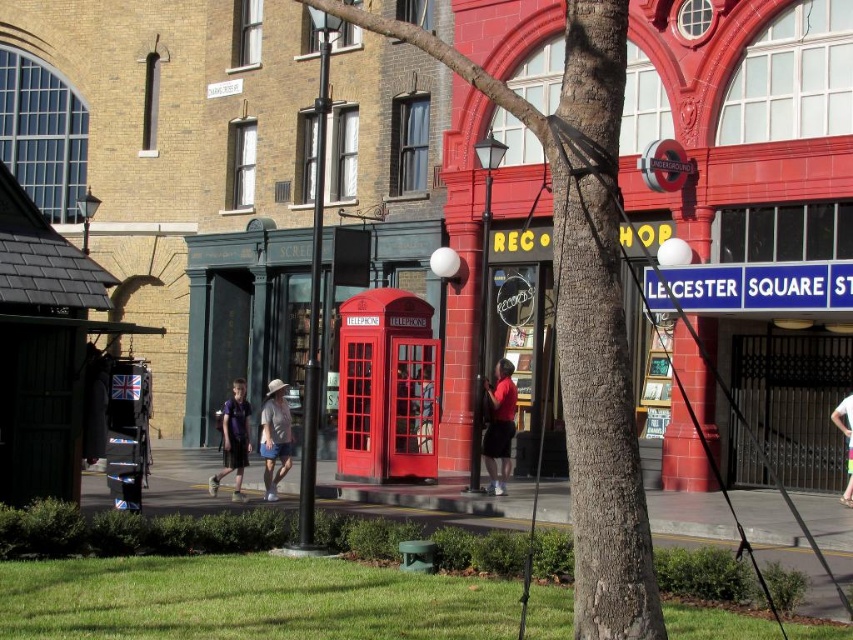
You are a photographer aiming to capture both the red matte shirt at center and the dark blue jersey at center in a single shot. Considering their heights, which one might you need to adjust your camera angle for to ensure both are fully visible?

The red matte shirt at center is not as tall as the dark blue jersey at center, so you might need to lower your camera angle to capture the taller dark blue jersey at center while still including the shorter red matte shirt at center in the frame.

Consider the image. You are a delivery person trying to place a large package on a surface. You see the glossy red telephone box at center and the dark blue jersey at center. Which object can you place the package on top of?

The glossy red telephone box at center is much taller than the dark blue jersey at center, so the package can be placed on top of the glossy red telephone box at center.

You are a photographer trying to capture both the red matte shirt at center and the dark blue jersey at center in a single shot. Which clothing item should you focus on first if you want to ensure both are in frame without zooming in or out?

The red matte shirt at center is smaller than the dark blue jersey at center, so you should focus on the dark blue jersey at center first to ensure it fits within the frame since it takes up more space.